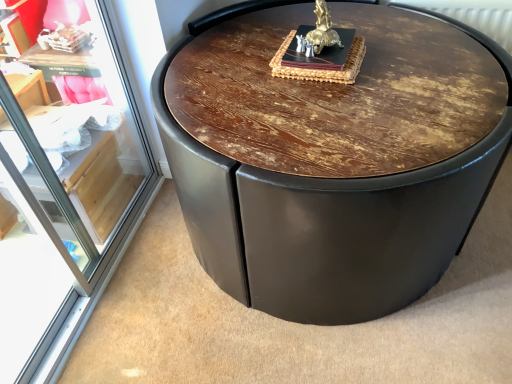
The image size is (512, 384). What do you see at coordinates (64, 187) in the screenshot? I see `transparent glass screen door at upper left` at bounding box center [64, 187].

What are the coordinates of `transparent glass screen door at upper left` in the screenshot? It's located at (64, 187).

Locate an element on the screen. The width and height of the screenshot is (512, 384). transparent glass screen door at upper left is located at coordinates (64, 187).